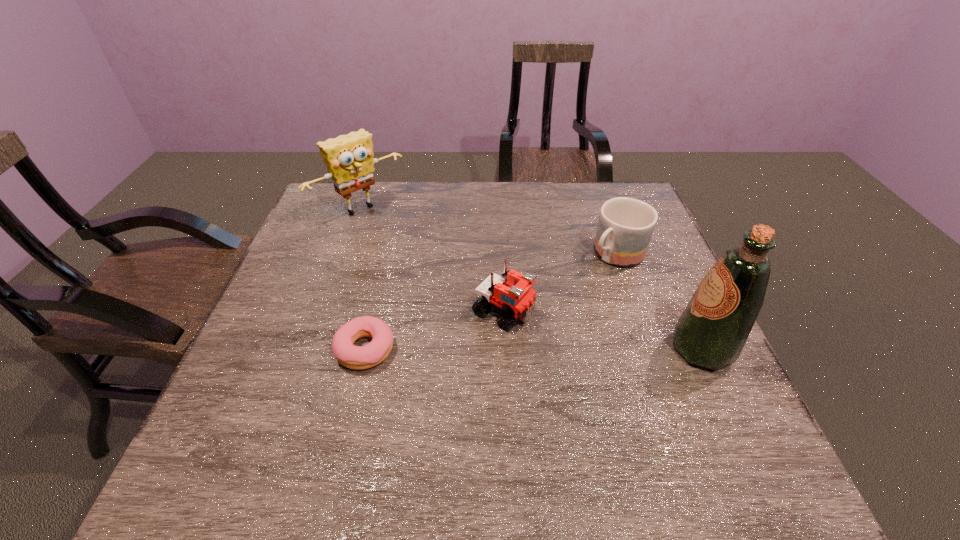
I want to click on blank space located on the face of the farthest object, so click(445, 282).

At what (x,y) coordinates should I click in order to perform the action: click on vacant space located 0.200m on the face of the farthest object. Please return your answer as a coordinate pair (x, y). This screenshot has width=960, height=540. Looking at the image, I should click on (420, 259).

Identify the location of vacant space located on the face of the farthest object. (418, 257).

Find the location of a particular element. vacant space situated 0.160m on the side with the handle of the second farthest object is located at coordinates (564, 300).

The height and width of the screenshot is (540, 960). I want to click on free location located on the side with the handle of the second farthest object, so click(554, 308).

Where is `blank area located on the side with the handle of the second farthest object`? Image resolution: width=960 pixels, height=540 pixels. blank area located on the side with the handle of the second farthest object is located at coordinates (549, 313).

You are a GUI agent. You are given a task and a screenshot of the screen. Output one action in this format:
    pyautogui.click(x=<x>, y=<y>)
    Task: Click on the free space located on the front-facing side of the third object from left to right
    The height and width of the screenshot is (540, 960).
    Given the screenshot: What is the action you would take?
    pyautogui.click(x=641, y=381)

Locate an element on the screen. This screenshot has height=540, width=960. free space located on the front-facing side of the third object from left to right is located at coordinates (632, 376).

At what (x,y) coordinates should I click in order to perform the action: click on vacant space located on the front-facing side of the third object from left to right. Please return your answer as a coordinate pair (x, y). This screenshot has height=540, width=960. Looking at the image, I should click on (664, 393).

You are a GUI agent. You are given a task and a screenshot of the screen. Output one action in this format:
    pyautogui.click(x=<x>, y=<y>)
    Task: Click on the object present at the far edge
    The image size is (960, 540).
    Given the screenshot: What is the action you would take?
    pyautogui.click(x=349, y=159)